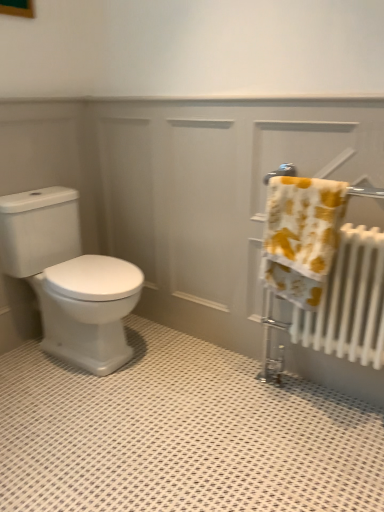
Locate an element on the screen. Image resolution: width=384 pixels, height=512 pixels. empty space that is ontop of white glossy radiator at right (from a real-world perspective) is located at coordinates (243, 92).